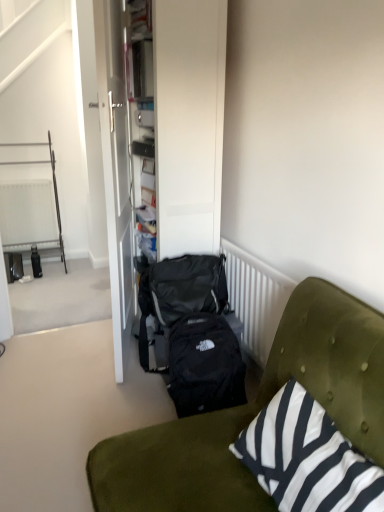
Question: Does velvet green couch at lower right have a greater width compared to white glossy door at center?

Choices:
 (A) yes
 (B) no

Answer: (A)

Question: Is velvet green couch at lower right outside of white glossy door at center?

Choices:
 (A) yes
 (B) no

Answer: (A)

Question: Considering the relative sizes of velvet green couch at lower right and white glossy door at center in the image provided, is velvet green couch at lower right taller than white glossy door at center?

Choices:
 (A) yes
 (B) no

Answer: (B)

Question: Would you say velvet green couch at lower right contains white glossy door at center?

Choices:
 (A) yes
 (B) no

Answer: (B)

Question: Is velvet green couch at lower right aimed at white glossy door at center?

Choices:
 (A) no
 (B) yes

Answer: (A)

Question: Looking at their shapes, would you say velvet green couch at lower right is wider or thinner than white glossy door at center?

Choices:
 (A) wide
 (B) thin

Answer: (A)

Question: Is velvet green couch at lower right in front of or behind white glossy door at center in the image?

Choices:
 (A) behind
 (B) front

Answer: (B)

Question: Considering the positions of velvet green couch at lower right and white glossy door at center in the image, is velvet green couch at lower right bigger or smaller than white glossy door at center?

Choices:
 (A) small
 (B) big

Answer: (B)

Question: Is point (344, 325) closer or farther from the camera than point (100, 60)?

Choices:
 (A) farther
 (B) closer

Answer: (B)

Question: From the image's perspective, is black and white striped cushion at lower right positioned above or below black fabric backpack at center, positioned as the 1th backpack in bottom-to-top order?

Choices:
 (A) below
 (B) above

Answer: (A)

Question: From a real-world perspective, is black and white striped cushion at lower right positioned above or below black fabric backpack at center, positioned as the 1th backpack in bottom-to-top order?

Choices:
 (A) above
 (B) below

Answer: (A)

Question: In terms of size, does black and white striped cushion at lower right appear bigger or smaller than black fabric backpack at center, positioned as the 1th backpack in bottom-to-top order?

Choices:
 (A) small
 (B) big

Answer: (B)

Question: Based on their positions, is black and white striped cushion at lower right located to the left or right of black fabric backpack at center, positioned as the 1th backpack in bottom-to-top order?

Choices:
 (A) left
 (B) right

Answer: (B)

Question: Would you say black fabric backpack at center, the second backpack positioned from the top, is to the left or to the right of black fabric backpack at center, which is the 2th backpack from bottom to top, in the picture?

Choices:
 (A) right
 (B) left

Answer: (A)

Question: In terms of width, does black fabric backpack at center, the second backpack positioned from the top, look wider or thinner when compared to black fabric backpack at center, which ranks as the first backpack in top-to-bottom order?

Choices:
 (A) thin
 (B) wide

Answer: (B)